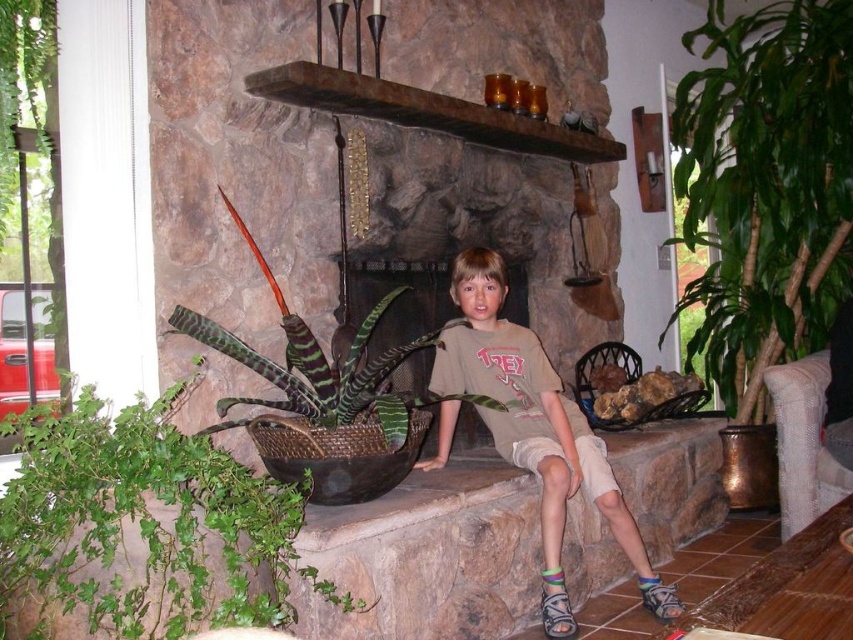
In the scene shown: You are standing in front of the fireplace and want to take a photo of the green leafy plant at right. If your camera has a maximum focus distance of 10 feet, will it be able to focus on the plant?

The green leafy plant at right and camera are 9.55 feet apart from each other, which is within the camera maximum focus distance of 10 feet. So yes, the camera can focus on the plant.

You are planning to place a new small potted plant in this room. The green leafy plant at right and the green woven basket at lower left are already present. Which object can you place a smaller potted plant next to without it being overshadowed?

The green woven basket at lower left is smaller than the green leafy plant at right, so placing a smaller potted plant next to the green woven basket at lower left would prevent it from being overshadowed.

You are designing a layout for a living room and want to place a small decorative item between the green leafy plant at right and the brown stone ledge at center. Which object should you place the item closer to if you want it to be near the larger object?

The green leafy plant at right is bigger than the brown stone ledge at center, so you should place the small decorative item closer to the green leafy plant at right.